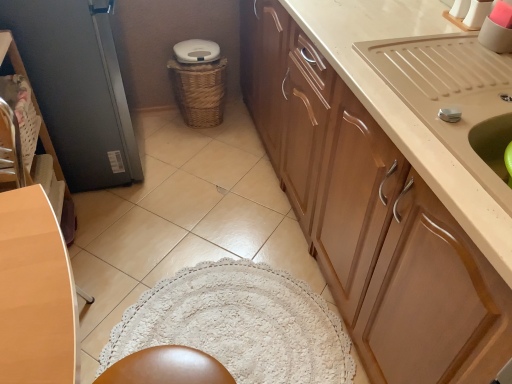
Question: Is beige glossy sink at upper right looking in the opposite direction of metallic gray screen door at left?

Choices:
 (A) no
 (B) yes

Answer: (A)

Question: Is beige glossy sink at upper right thinner than metallic gray screen door at left?

Choices:
 (A) yes
 (B) no

Answer: (A)

Question: Considering the relative sizes of beige glossy sink at upper right and metallic gray screen door at left in the image provided, is beige glossy sink at upper right taller than metallic gray screen door at left?

Choices:
 (A) yes
 (B) no

Answer: (B)

Question: Would you say metallic gray screen door at left is part of beige glossy sink at upper right's contents?

Choices:
 (A) yes
 (B) no

Answer: (B)

Question: Is beige glossy sink at upper right not near metallic gray screen door at left?

Choices:
 (A) yes
 (B) no

Answer: (A)

Question: In terms of size, does woven brown basket at center appear bigger or smaller than beige glossy sink at upper right?

Choices:
 (A) big
 (B) small

Answer: (B)

Question: From their relative heights in the image, would you say woven brown basket at center is taller or shorter than beige glossy sink at upper right?

Choices:
 (A) tall
 (B) short

Answer: (A)

Question: Which is correct: woven brown basket at center is inside beige glossy sink at upper right, or outside of it?

Choices:
 (A) inside
 (B) outside

Answer: (B)

Question: From the image's perspective, relative to beige glossy sink at upper right, is woven brown basket at center above or below?

Choices:
 (A) below
 (B) above

Answer: (B)

Question: Does point (48, 175) appear closer or farther from the camera than point (440, 61)?

Choices:
 (A) closer
 (B) farther

Answer: (B)

Question: Relative to beige glossy sink at upper right, is matte brown chair at left in front or behind?

Choices:
 (A) behind
 (B) front

Answer: (A)

Question: Is matte brown chair at left spatially inside beige glossy sink at upper right, or outside of it?

Choices:
 (A) outside
 (B) inside

Answer: (A)

Question: In terms of height, does matte brown chair at left look taller or shorter compared to beige glossy sink at upper right?

Choices:
 (A) tall
 (B) short

Answer: (A)

Question: Is beige glossy sink at upper right inside the boundaries of metallic gray screen door at left, or outside?

Choices:
 (A) outside
 (B) inside

Answer: (A)

Question: Looking at the image, does beige glossy sink at upper right seem bigger or smaller compared to metallic gray screen door at left?

Choices:
 (A) big
 (B) small

Answer: (B)